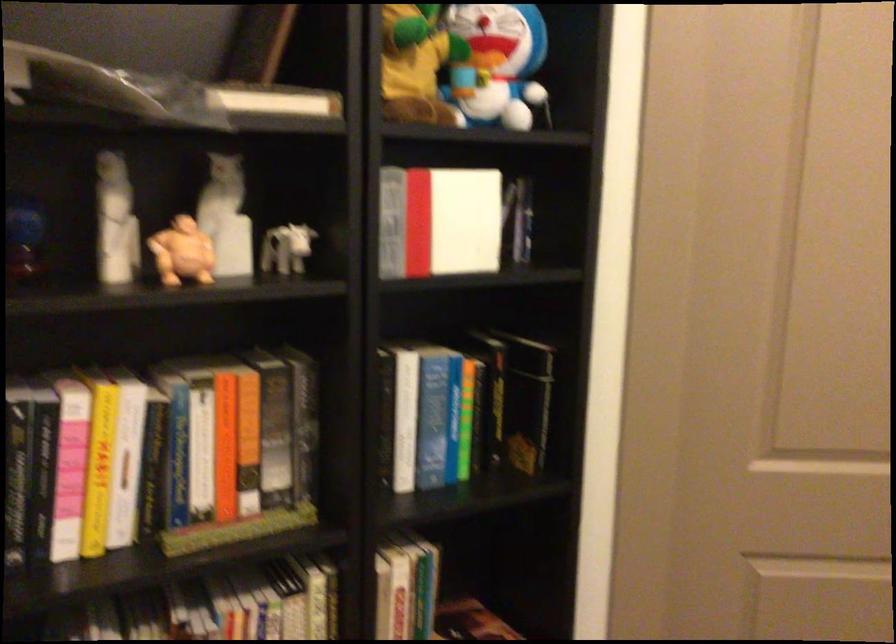
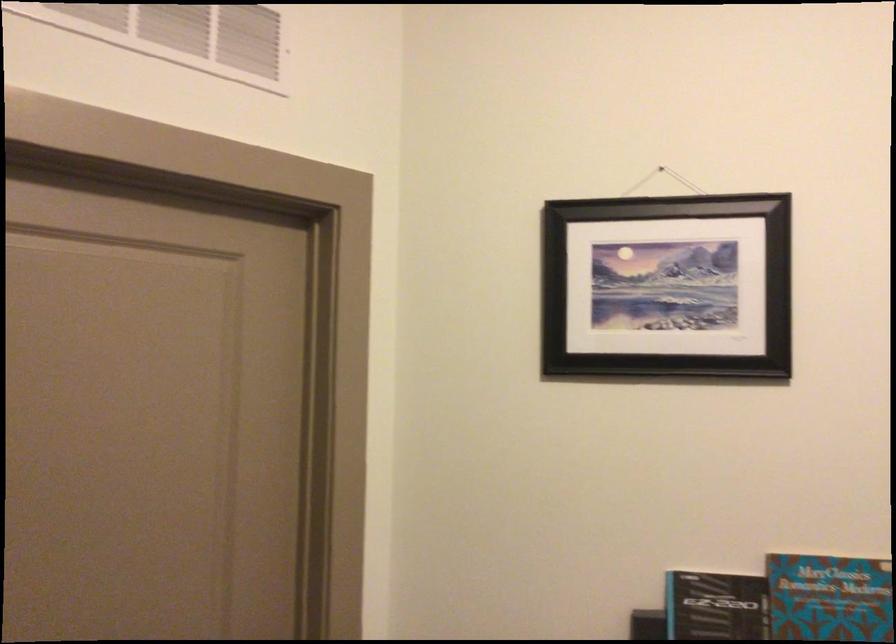
Question: The first image is from the beginning of the video and the second image is from the end. How did the camera likely rotate when shooting the video?

Choices:
 (A) Left
 (B) Right
 (C) Up
 (D) Down

Answer: (B)